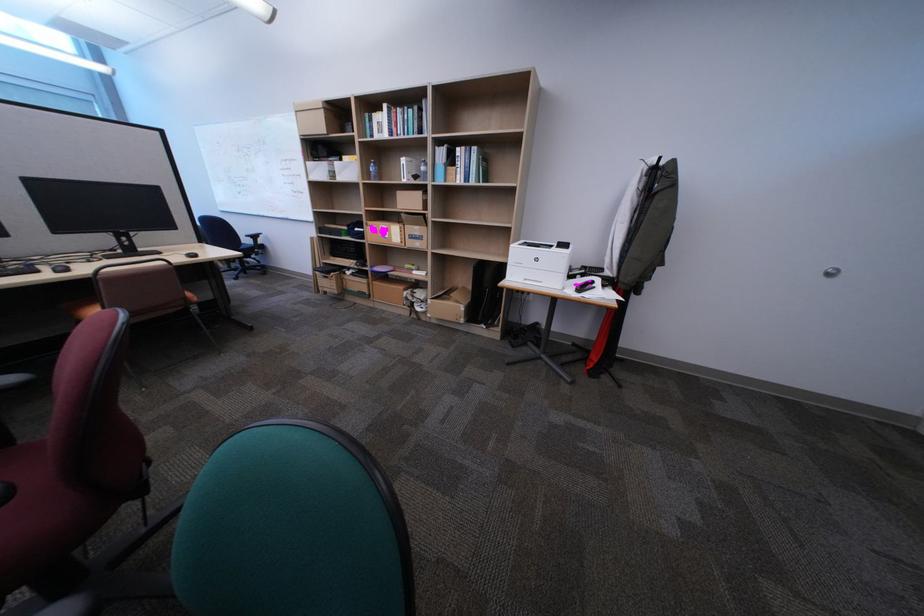
Where would you grasp the clear water bottle? Please return your answer as a coordinate pair (x, y).

(372, 169)